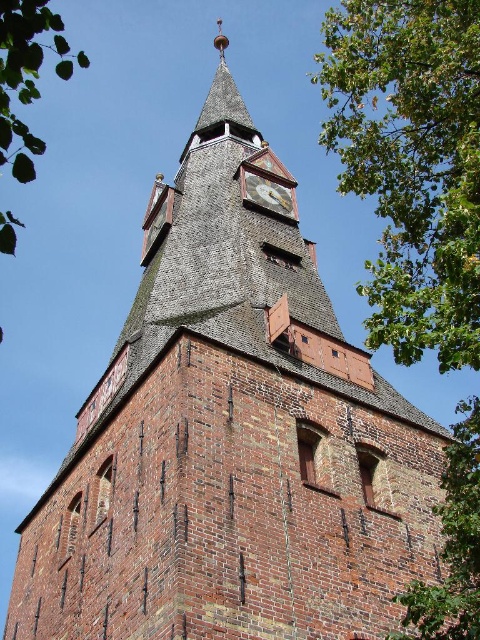
Does green leafy tree at upper right appear on the left side of gold metallic clock at center?

No, green leafy tree at upper right is not to the left of gold metallic clock at center.

Is point (396, 88) farther from viewer compared to point (276, 202)?

That is False.

Locate an element on the screen. This screenshot has width=480, height=640. green leafy tree at upper right is located at coordinates (411, 164).

Looking at this image, can you confirm if green leafy tree at upper right is positioned to the right of green leafy tree at upper left?

Yes, green leafy tree at upper right is to the right of green leafy tree at upper left.

Which is behind, point (468, 438) or point (11, 134)?

Point (468, 438)

Between point (400, 262) and point (15, 241), which one is positioned in front?

Point (400, 262) is in front.

Find the location of a particular element. green leafy tree at upper right is located at coordinates (411, 164).

Is green leafy tree at upper left to the right of gold metallic clock at center from the viewer's perspective?

In fact, green leafy tree at upper left is to the left of gold metallic clock at center.

Is point (19, 42) farther from viewer compared to point (272, 205)?

No, it is in front of (272, 205).

This screenshot has height=640, width=480. What are the coordinates of `green leafy tree at upper left` in the screenshot? It's located at (27, 76).